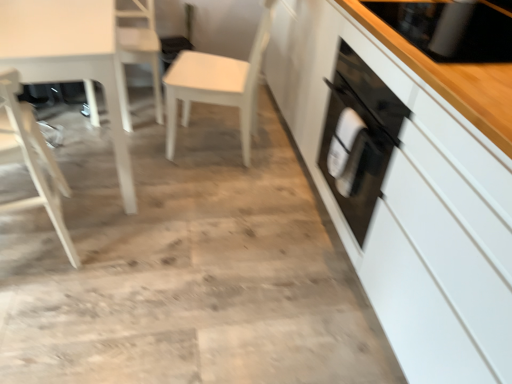
Question: Is white glossy table at left surrounding white glossy cabinet at right?

Choices:
 (A) yes
 (B) no

Answer: (B)

Question: Considering the relative positions of white glossy table at left and white glossy cabinet at right in the image provided, is white glossy table at left to the right of white glossy cabinet at right from the viewer's perspective?

Choices:
 (A) yes
 (B) no

Answer: (B)

Question: Is white glossy table at left further to the viewer compared to white glossy cabinet at right?

Choices:
 (A) yes
 (B) no

Answer: (A)

Question: Is white glossy table at left with white glossy cabinet at right?

Choices:
 (A) no
 (B) yes

Answer: (A)

Question: Is white glossy table at left facing away from white glossy cabinet at right?

Choices:
 (A) yes
 (B) no

Answer: (B)

Question: From the image's perspective, relative to white glossy cabinet at right, is white wood chair at upper left, the 2th chair when ordered from left to right, above or below?

Choices:
 (A) below
 (B) above

Answer: (B)

Question: Considering their positions, is white wood chair at upper left, positioned as the 2th chair in right-to-left order, located in front of or behind white glossy cabinet at right?

Choices:
 (A) front
 (B) behind

Answer: (B)

Question: Which is correct: white wood chair at upper left, the 2th chair when ordered from left to right, is inside white glossy cabinet at right, or outside of it?

Choices:
 (A) outside
 (B) inside

Answer: (A)

Question: Considering the positions of white wood chair at upper left, the 2th chair when ordered from left to right, and white glossy cabinet at right in the image, is white wood chair at upper left, the 2th chair when ordered from left to right, wider or thinner than white glossy cabinet at right?

Choices:
 (A) thin
 (B) wide

Answer: (A)

Question: In the image, is white matte chair at center, the 1th chair viewed from the right, positioned in front of or behind white wood chair at upper left, positioned as the 2th chair in right-to-left order?

Choices:
 (A) behind
 (B) front

Answer: (B)

Question: Looking at their shapes, would you say white matte chair at center, the 1th chair viewed from the right, is wider or thinner than white wood chair at upper left, the 2th chair when ordered from left to right?

Choices:
 (A) wide
 (B) thin

Answer: (A)

Question: Does point (259, 54) appear closer or farther from the camera than point (121, 62)?

Choices:
 (A) closer
 (B) farther

Answer: (A)

Question: Would you say white matte chair at center, the 1th chair viewed from the right, is to the left or to the right of white wood chair at upper left, positioned as the 2th chair in right-to-left order, in the picture?

Choices:
 (A) left
 (B) right

Answer: (B)

Question: Based on their positions, is white matte chair at center, the 1th chair viewed from the right, located to the left or right of white wood chair at left, positioned as the first chair in left-to-right order?

Choices:
 (A) left
 (B) right

Answer: (B)

Question: From the image's perspective, relative to white wood chair at left, positioned as the first chair in left-to-right order, is white matte chair at center, the 1th chair viewed from the right, above or below?

Choices:
 (A) above
 (B) below

Answer: (A)